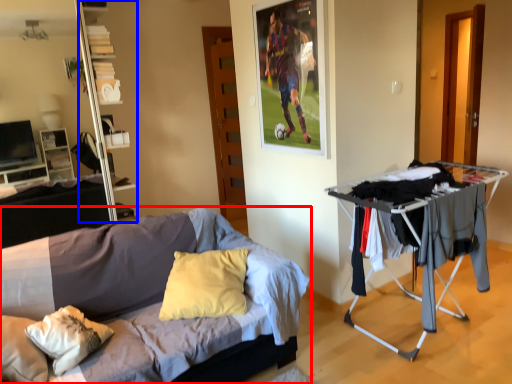
Question: Among these objects, which one is farthest to the camera, bed (highlighted by a red box) or shelf (highlighted by a blue box)?

Choices:
 (A) bed
 (B) shelf

Answer: (B)